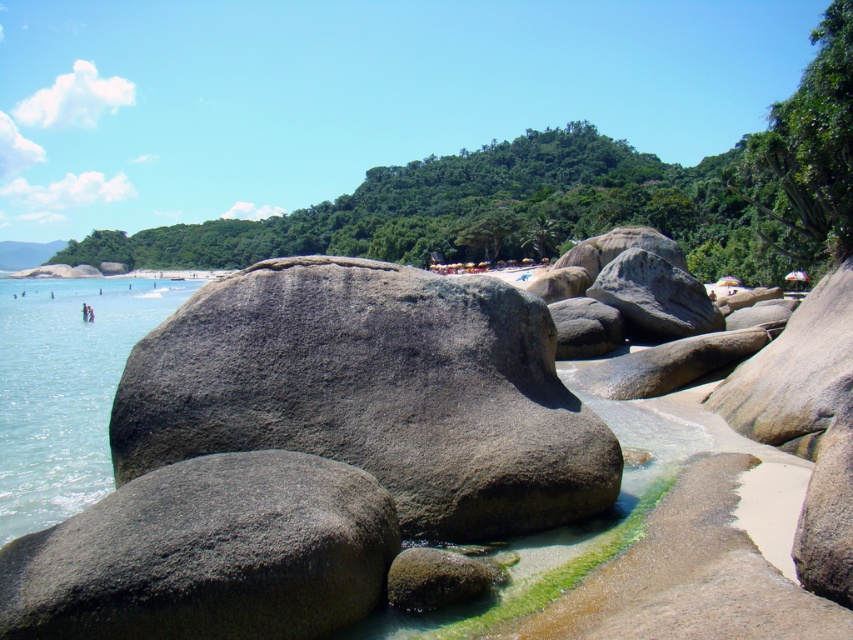
You are standing at the point marked as point [207,554] in the image. Based on the scene description, what object are you most likely standing on?

You are most likely standing on the gray textured rock at lower left, as the point [207,554] corresponds to this object according to the description.

You are standing on the beach and want to cross to the other side. You see the gray rough boulder at center and the clear water at left. Which object is blocking your path?

The gray rough boulder at center is positioned under clear water at left, so the gray rough boulder at center is blocking your path.